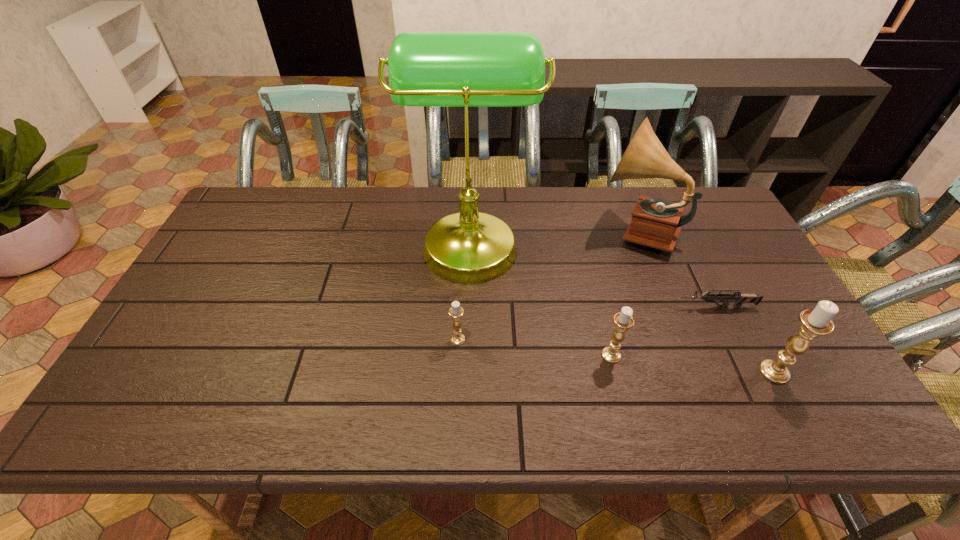
Image resolution: width=960 pixels, height=540 pixels. In order to click on the third nearest object in this screenshot , I will do `click(457, 338)`.

At what (x,y) coordinates should I click in order to perform the action: click on the farthest candle holder. Please return your answer as a coordinate pair (x, y). This screenshot has width=960, height=540. Looking at the image, I should click on (457, 338).

Where is `the fourth tallest object`? the fourth tallest object is located at coordinates (623, 320).

You are a GUI agent. You are given a task and a screenshot of the screen. Output one action in this format:
    pyautogui.click(x=<x>, y=<y>)
    Task: Click on the fourth object from right to left
    The height and width of the screenshot is (540, 960).
    Given the screenshot: What is the action you would take?
    pos(623,320)

You are a GUI agent. You are given a task and a screenshot of the screen. Output one action in this format:
    pyautogui.click(x=<x>, y=<y>)
    Task: Click on the tallest candle holder
    The height and width of the screenshot is (540, 960).
    Given the screenshot: What is the action you would take?
    pyautogui.click(x=815, y=322)

Identify the location of the rightmost candle holder. The image size is (960, 540). (815, 322).

This screenshot has width=960, height=540. Find the location of `lamp`. lamp is located at coordinates (466, 69).

Find the location of a particular element. Image resolution: width=960 pixels, height=540 pixels. the second tallest object is located at coordinates (656, 223).

Locate an element on the screen. the shortest object is located at coordinates (739, 298).

At what (x,y) coordinates should I click in order to perform the action: click on gun. Please return your answer as a coordinate pair (x, y). Looking at the image, I should click on (739, 298).